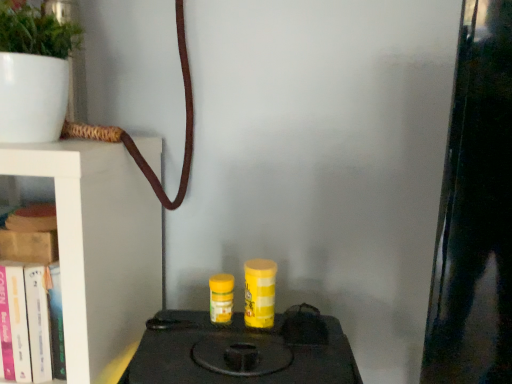
Question: Is hardcover book at left, acting as the second book starting from the top, taller than white matte pot at upper left?

Choices:
 (A) no
 (B) yes

Answer: (A)

Question: Is the depth of hardcover book at left, marked as the 1th book in a bottom-to-top arrangement, greater than that of white matte pot at upper left?

Choices:
 (A) yes
 (B) no

Answer: (A)

Question: Can you confirm if hardcover book at left, marked as the 1th book in a bottom-to-top arrangement, is wider than white matte pot at upper left?

Choices:
 (A) no
 (B) yes

Answer: (A)

Question: Can you confirm if hardcover book at left, marked as the 1th book in a bottom-to-top arrangement, is thinner than white matte pot at upper left?

Choices:
 (A) no
 (B) yes

Answer: (B)

Question: From the image's perspective, does hardcover book at left, marked as the 1th book in a bottom-to-top arrangement, appear higher than white matte pot at upper left?

Choices:
 (A) yes
 (B) no

Answer: (B)

Question: Would you say white matte pot at upper left is to the left or to the right of hardcover book at left, marked as the 1th book in a bottom-to-top arrangement, in the picture?

Choices:
 (A) right
 (B) left

Answer: (A)

Question: Is white matte pot at upper left spatially inside hardcover book at left, marked as the 1th book in a bottom-to-top arrangement, or outside of it?

Choices:
 (A) outside
 (B) inside

Answer: (A)

Question: Considering the positions of white matte pot at upper left and hardcover book at left, acting as the second book starting from the top, in the image, is white matte pot at upper left taller or shorter than hardcover book at left, acting as the second book starting from the top,?

Choices:
 (A) tall
 (B) short

Answer: (A)

Question: In terms of width, does white matte pot at upper left look wider or thinner when compared to hardcover book at left, marked as the 1th book in a bottom-to-top arrangement?

Choices:
 (A) thin
 (B) wide

Answer: (B)

Question: Is black matte stove at center inside or outside of hardcover book at left, marked as the 1th book in a bottom-to-top arrangement?

Choices:
 (A) inside
 (B) outside

Answer: (B)

Question: In the image, is black matte stove at center positioned in front of or behind hardcover book at left, acting as the second book starting from the top?

Choices:
 (A) behind
 (B) front

Answer: (B)

Question: Considering the positions of black matte stove at center and hardcover book at left, marked as the 1th book in a bottom-to-top arrangement, in the image, is black matte stove at center bigger or smaller than hardcover book at left, marked as the 1th book in a bottom-to-top arrangement,?

Choices:
 (A) small
 (B) big

Answer: (B)

Question: From a real-world perspective, is black matte stove at center physically located above or below hardcover book at left, acting as the second book starting from the top?

Choices:
 (A) below
 (B) above

Answer: (A)

Question: Relative to white matte pot at upper left, is wooden book at left, acting as the 2th book starting from the bottom, in front or behind?

Choices:
 (A) front
 (B) behind

Answer: (B)

Question: Considering the positions of wooden book at left, acting as the 2th book starting from the bottom, and white matte pot at upper left in the image, is wooden book at left, acting as the 2th book starting from the bottom, bigger or smaller than white matte pot at upper left?

Choices:
 (A) small
 (B) big

Answer: (A)